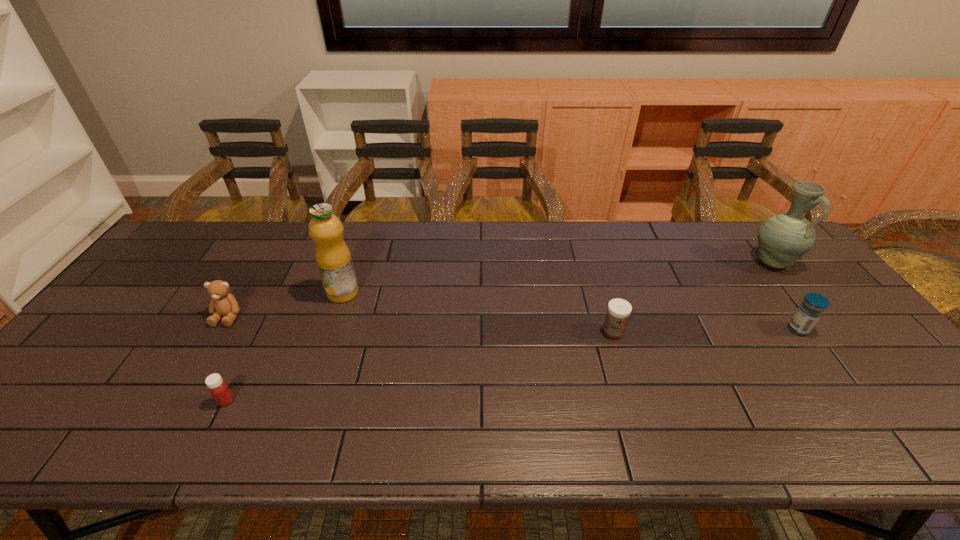
Image resolution: width=960 pixels, height=540 pixels. In order to click on the fifth nearest object in this screenshot , I will do `click(333, 257)`.

The height and width of the screenshot is (540, 960). What are the coordinates of `fruit juice` in the screenshot? It's located at (333, 257).

Where is `the farthest object`? Image resolution: width=960 pixels, height=540 pixels. the farthest object is located at coordinates (783, 239).

Where is `the leftmost object`? The image size is (960, 540). the leftmost object is located at coordinates (223, 303).

Find the location of a particular element. Image resolution: width=960 pixels, height=540 pixels. the rightmost medicine is located at coordinates (811, 309).

Identify the location of the third object from right to left. (618, 310).

The image size is (960, 540). What are the coordinates of `the fifth object from right to left` in the screenshot? It's located at (218, 388).

Identify the location of the nearest object. This screenshot has height=540, width=960. (218, 388).

Identify the location of vacant space located on the front label of the third object from left to right. (324, 351).

You are a GUI agent. You are given a task and a screenshot of the screen. Output one action in this format:
    pyautogui.click(x=<x>, y=<y>)
    Task: Click on the vacant space situated 0.330m on the handle side of the pitcher
    The image size is (960, 540).
    Given the screenshot: What is the action you would take?
    pyautogui.click(x=854, y=366)